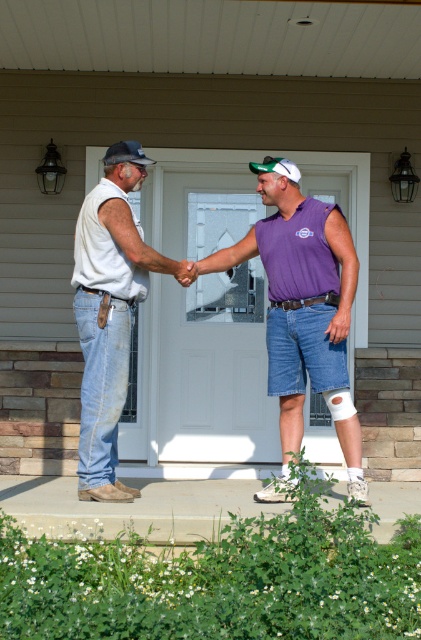
Does purple fabric sleeveless shirt at center have a greater height compared to denim jeans at left?

No, purple fabric sleeveless shirt at center is not taller than denim jeans at left.

Who is more forward, (348, 282) or (138, 244)?

Point (348, 282) is in front.

At what (x,y) coordinates should I click in order to perform the action: click on purple fabric sleeveless shirt at center. Please return your answer as a coordinate pair (x, y). This screenshot has height=640, width=421. Looking at the image, I should click on (298, 298).

Can you confirm if denim jeans at left is positioned below white matte bandage at lower center?

Actually, denim jeans at left is above white matte bandage at lower center.

Who is taller, denim jeans at left or white matte bandage at lower center?

Standing taller between the two is denim jeans at left.

The height and width of the screenshot is (640, 421). I want to click on denim jeans at left, so click(x=109, y=310).

Can you confirm if purple fabric sleeveless shirt at center is smaller than white matte bandage at lower center?

Incorrect, purple fabric sleeveless shirt at center is not smaller in size than white matte bandage at lower center.

Does purple fabric sleeveless shirt at center have a greater width compared to white matte bandage at lower center?

Indeed, purple fabric sleeveless shirt at center has a greater width compared to white matte bandage at lower center.

At what (x,y) coordinates should I click in order to perform the action: click on purple fabric sleeveless shirt at center. Please return your answer as a coordinate pair (x, y). The image size is (421, 640). Looking at the image, I should click on (298, 298).